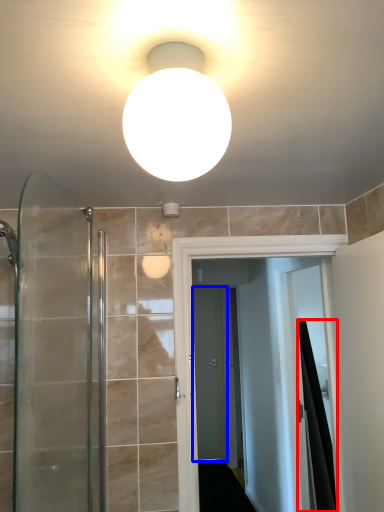
Question: Among these objects, which one is farthest to the camera, shower curtain (highlighted by a red box) or screen door (highlighted by a blue box)?

Choices:
 (A) shower curtain
 (B) screen door

Answer: (B)